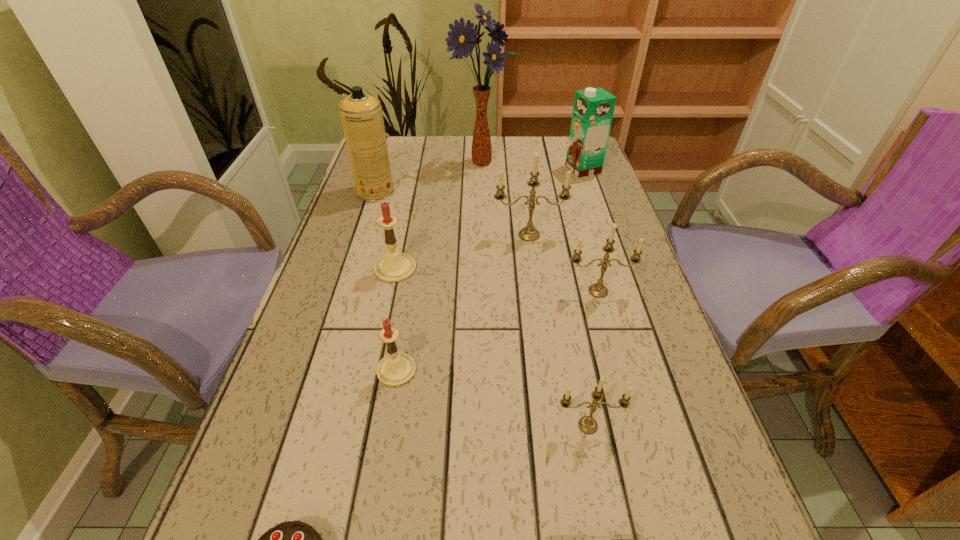
This screenshot has height=540, width=960. What are the coordinates of `blank space located 0.150m on the left of the second smallest metallic candle` in the screenshot? It's located at (496, 291).

Locate an element on the screen. vacant area situated 0.230m on the left of the nearest candle is located at coordinates (417, 425).

Locate an element on the screen. The image size is (960, 540). free spot located on the right of the nearer red candle is located at coordinates (487, 370).

Find the location of a particular element. This screenshot has height=540, width=960. flower arrangement at the far edge is located at coordinates (463, 39).

Find the location of a particular element. This screenshot has width=960, height=540. carton that is at the far edge is located at coordinates (593, 109).

The width and height of the screenshot is (960, 540). What are the coordinates of `aerosol can at the left edge` in the screenshot? It's located at (361, 115).

Find the location of a particular element. This screenshot has height=540, width=960. candle located at the left edge is located at coordinates (393, 267).

Where is `carton at the right edge`? carton at the right edge is located at coordinates (593, 109).

The height and width of the screenshot is (540, 960). Find the location of `object at the far right corner`. object at the far right corner is located at coordinates (593, 109).

Where is `vacant space at the far edge`? This screenshot has height=540, width=960. vacant space at the far edge is located at coordinates (471, 143).